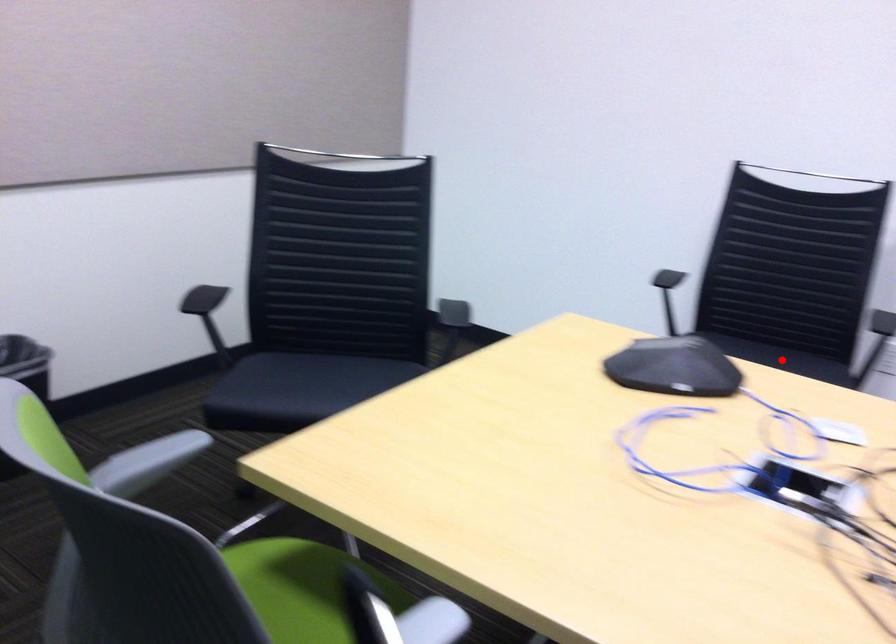
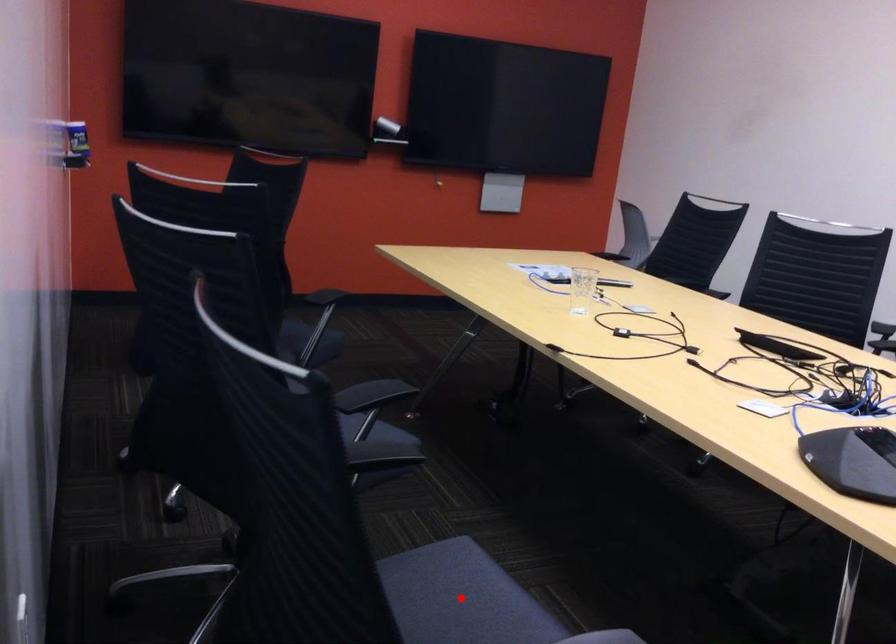
I am providing you with two images of the same scene from different viewpoints. A red point is marked on the first image and another point is marked on the second image. Do the highlighted points in image1 and image2 indicate the same real-world spot?

Yes